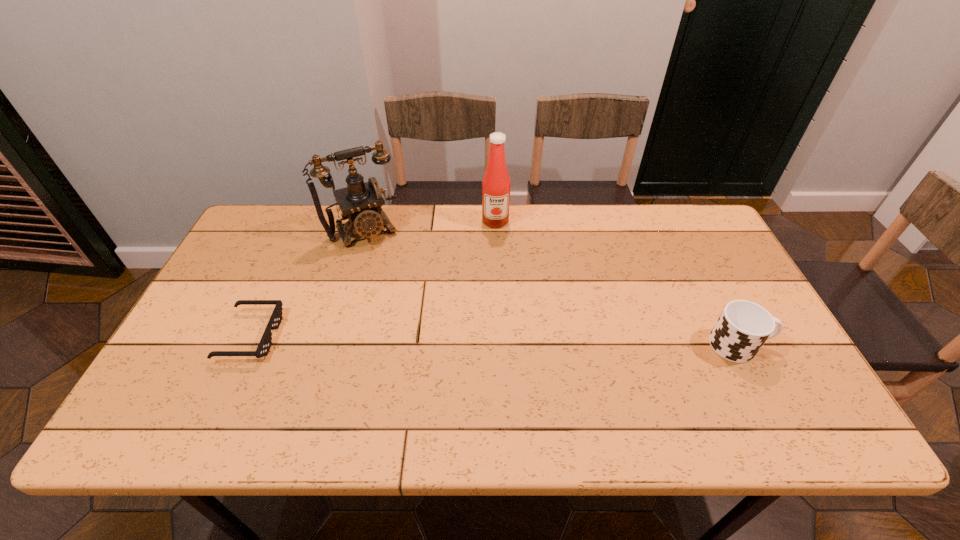
Locate an element on the screen. free space between the cup and the sunglasses is located at coordinates (x=494, y=341).

Locate an element on the screen. The image size is (960, 540). free spot between the second object from left to right and the leftmost object is located at coordinates (307, 283).

Identify the location of free spot between the third tallest object and the shortest object. Image resolution: width=960 pixels, height=540 pixels. (494, 341).

Identify the location of object that is the second closest to the rightmost object. The image size is (960, 540). (360, 203).

I want to click on object that stands as the third closest to the sunglasses, so click(x=743, y=327).

The image size is (960, 540). Find the location of `free space that satisfies the following two spatial constraints: 1. on the front side of the rightmost object; 2. on the side of the third object from left to right with the handle`. free space that satisfies the following two spatial constraints: 1. on the front side of the rightmost object; 2. on the side of the third object from left to right with the handle is located at coordinates (500, 345).